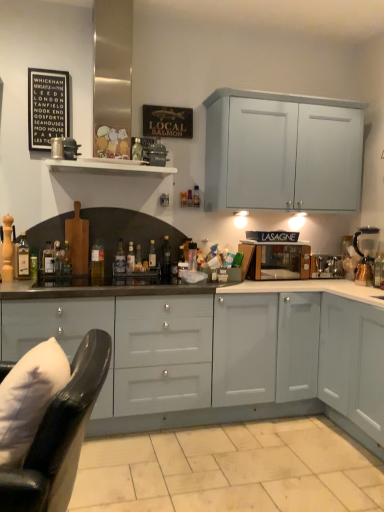
Question: Considering their positions, is beige tile at lower center located in front of or behind white wooden shelf at upper center?

Choices:
 (A) front
 (B) behind

Answer: (A)

Question: Considering the relative positions of beige tile at lower center and white wooden shelf at upper center in the image provided, is beige tile at lower center to the left or to the right of white wooden shelf at upper center?

Choices:
 (A) right
 (B) left

Answer: (A)

Question: Which object is positioned farthest from the white wooden shelf at upper center?

Choices:
 (A) black glass bottle at center, positioned as the 1th bottle in right-to-left order
 (B) translucent glass bottle at center, the 3th bottle positioned from the right
 (C) translucent glass bottle at center, the fifth bottle when ordered from right to left
 (D) satin silver toaster at right, acting as the 1th appliance starting from the right
 (E) translucent glass bottle at center, which appears as the 9th bottle when viewed from the right

Answer: (D)

Question: Estimate the real-world distances between objects in this image. Which object is farther from the black leather swivel chair at lower left?

Choices:
 (A) black glass bottle at center, which appears as the 11th bottle when viewed from the left
 (B) translucent glass bottle at center, which is the 9th bottle in left-to-right order
 (C) translucent glass bottle at left, which is the 10th bottle in right-to-left order
 (D) translucent glass bottle at center, arranged as the 8th bottle when viewed from the left
 (E) translucent glass bottle at center, which appears as the 9th bottle when viewed from the right

Answer: (B)